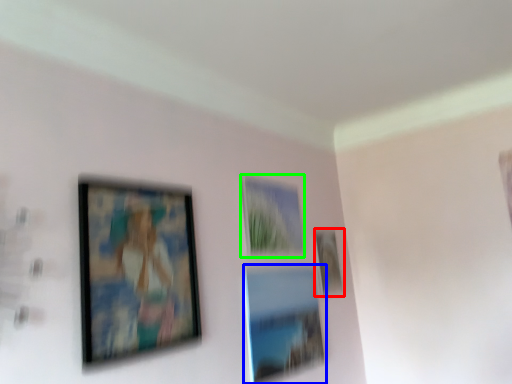
Question: Which object is positioned closest to picture frame (highlighted by a red box)? Select from picture frame (highlighted by a blue box) and picture frame (highlighted by a green box).

Choices:
 (A) picture frame
 (B) picture frame

Answer: (B)